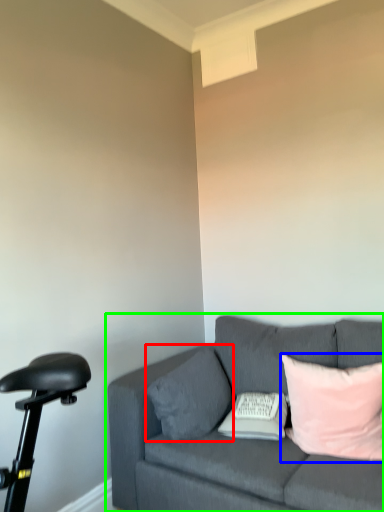
Question: Estimate the real-world distances between objects in this image. Which object is farther from pillow (highlighted by a red box), pillow (highlighted by a blue box) or studio couch (highlighted by a green box)?

Choices:
 (A) pillow
 (B) studio couch

Answer: (A)